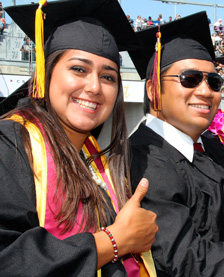
Where is `shades`? The width and height of the screenshot is (224, 277). shades is located at coordinates (192, 76).